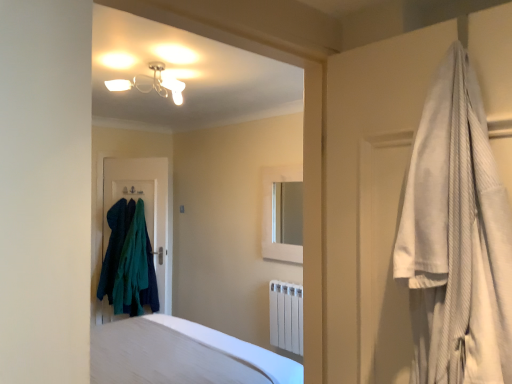
Question: Is white smooth bed at lower center wider or thinner than white textured robe at right?

Choices:
 (A) wide
 (B) thin

Answer: (A)

Question: Is white smooth bed at lower center spatially inside white textured robe at right, or outside of it?

Choices:
 (A) inside
 (B) outside

Answer: (B)

Question: Estimate the real-world distances between objects in this image. Which object is closer to the dark teal fabric door at center?

Choices:
 (A) white matte radiator at lower center
 (B) white matte medicine cabinet at center
 (C) white smooth bed at lower center
 (D) teal fabric towels at left
 (E) white textured robe at right

Answer: (D)

Question: Considering the real-world distances, which object is closest to the white matte radiator at lower center?

Choices:
 (A) white matte medicine cabinet at center
 (B) teal fabric towels at left
 (C) white textured robe at right
 (D) white smooth bed at lower center
 (E) dark teal fabric door at center

Answer: (A)